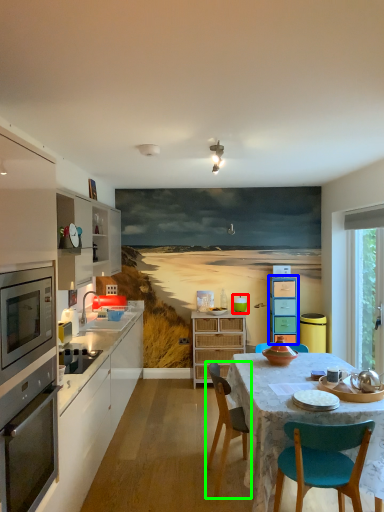
Question: Estimate the real-world distances between objects in this image. Which object is closer to teal (highlighted by a red box), cabinetry (highlighted by a blue box) or chair (highlighted by a green box)?

Choices:
 (A) cabinetry
 (B) chair

Answer: (A)